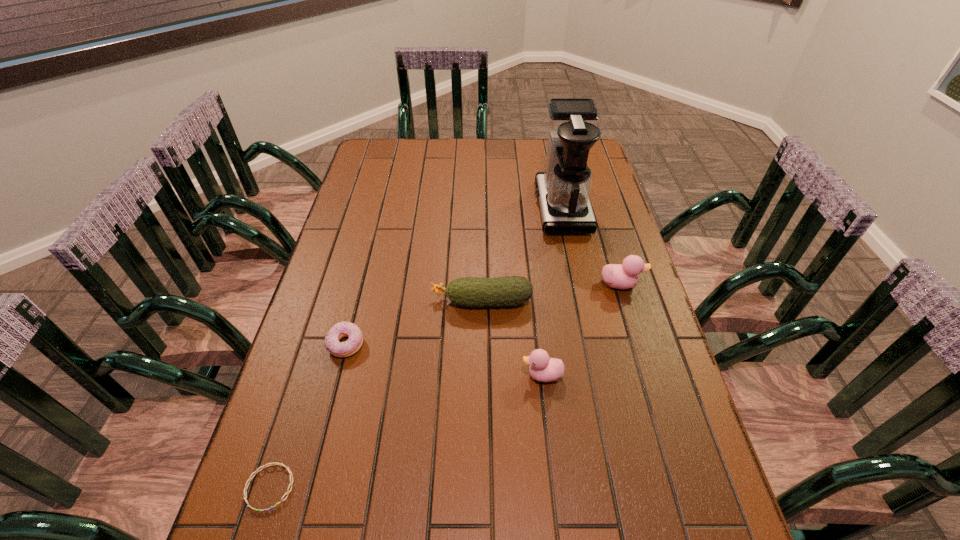
You are a GUI agent. You are given a task and a screenshot of the screen. Output one action in this format:
    pyautogui.click(x=<x>, y=<y>)
    Task: Click on the nearest object
    The height and width of the screenshot is (540, 960).
    Given the screenshot: What is the action you would take?
    pyautogui.click(x=274, y=463)

Locate an element on the screen. free region located on the front-facing side of the left duckling is located at coordinates (450, 375).

You are a GUI agent. You are given a task and a screenshot of the screen. Output one action in this format:
    pyautogui.click(x=<x>, y=<y>)
    Task: Click on the free space located on the front-facing side of the left duckling
    
    Given the screenshot: What is the action you would take?
    pyautogui.click(x=434, y=375)

Locate an element on the screen. This screenshot has width=960, height=540. free space located 0.390m on the front-facing side of the left duckling is located at coordinates (358, 375).

At what (x,y) coordinates should I click in order to perform the action: click on free location located at the front of the tallest object where the controls are located. Please return your answer as a coordinate pair (x, y). Image resolution: width=960 pixels, height=540 pixels. Looking at the image, I should click on (421, 208).

The image size is (960, 540). I want to click on vacant space located 0.270m at the front of the tallest object where the controls are located, so click(457, 208).

The height and width of the screenshot is (540, 960). I want to click on free space located 0.360m at the front of the tallest object where the controls are located, so click(x=431, y=208).

Locate an element on the screen. The image size is (960, 540). vacant area situated on the right of the third nearest object is located at coordinates (518, 345).

This screenshot has width=960, height=540. In order to click on free space located at the blossom end of the cucumber in this screenshot , I will do `click(319, 301)`.

The width and height of the screenshot is (960, 540). I want to click on vacant region located 0.160m at the blossom end of the cucumber, so click(x=373, y=301).